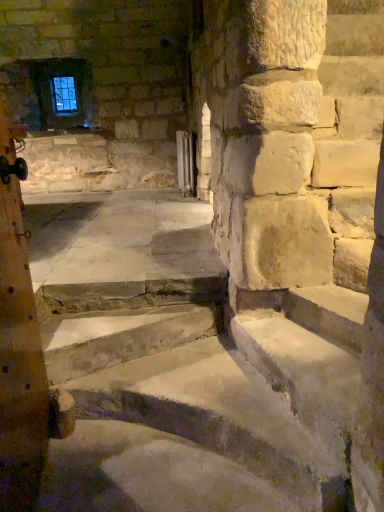
Question: In terms of size, does metallic radiator at center appear bigger or smaller than wooden post at left?

Choices:
 (A) big
 (B) small

Answer: (B)

Question: Considering their positions, is metallic radiator at center located in front of or behind wooden post at left?

Choices:
 (A) behind
 (B) front

Answer: (A)

Question: Which object is the farthest from the clear glass window screen at upper left?

Choices:
 (A) smooth stone stairs at center
 (B) metallic radiator at center
 (C) wooden post at left

Answer: (A)

Question: Which is farther from the wooden post at left?

Choices:
 (A) metallic radiator at center
 (B) smooth stone stairs at center
 (C) clear glass window screen at upper left

Answer: (C)